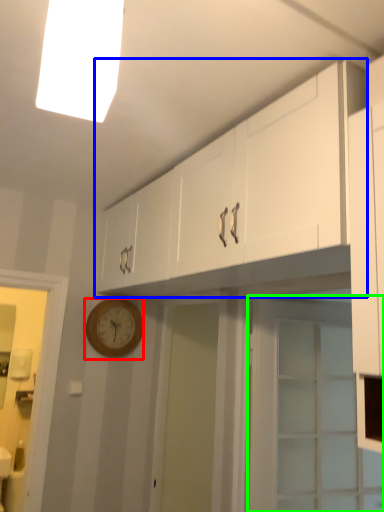
Question: Which object is the farthest from wall clock (highlighted by a red box)? Choose among these: cabinetry (highlighted by a blue box) or door (highlighted by a green box).

Choices:
 (A) cabinetry
 (B) door

Answer: (B)